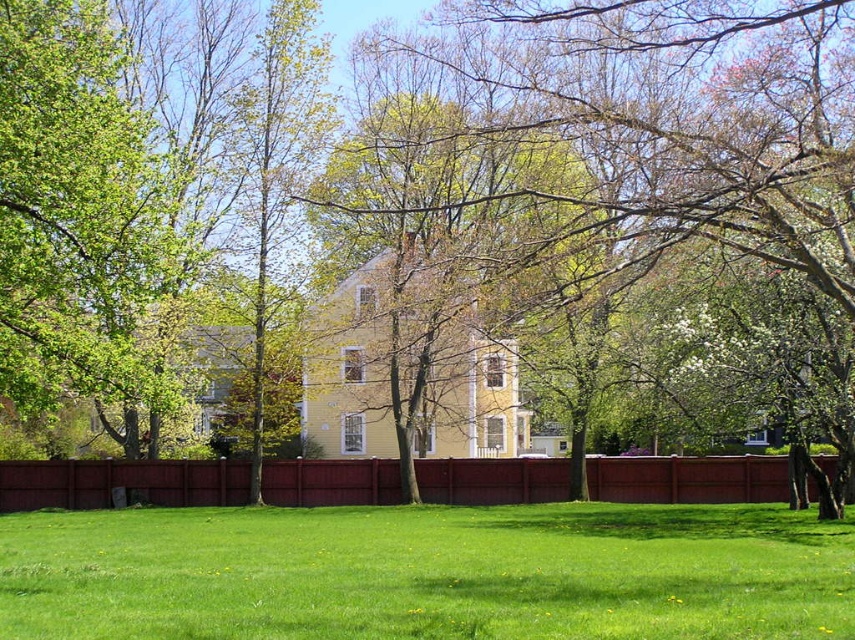
You are a gardener planning to plant a row of flowers between the green grass at center and the burgundy wood fence at center. Which area has more space available for planting?

The burgundy wood fence at center has more space available for planting since the green grass at center is thinner, indicating it is narrower than the fence.

You are standing at the point labeled as point [428,573] in the image. What is the surface you are currently standing on?

The surface at point [428,573] is green grass at center.

You are standing in the suburban scene and want to walk towards the house. Which object, the green grass at center or the burgundy wood fence at center, would you step on first?

The green grass at center is positioned over the burgundy wood fence at center, so you would step on the green grass at center first.